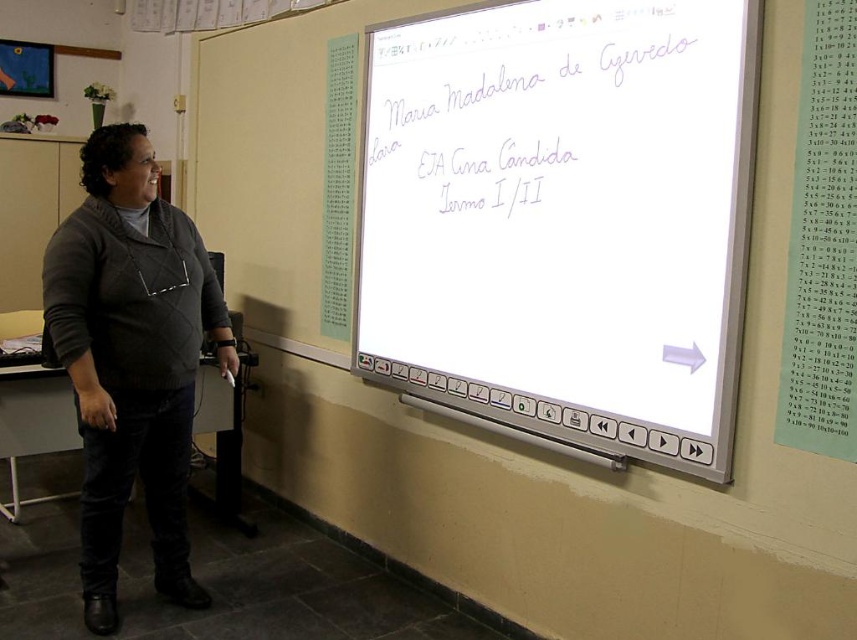
Question: Which point is farther to the camera?

Choices:
 (A) (97, 604)
 (B) (372, 269)

Answer: (B)

Question: Is white glossy screen at upper center smaller than dark gray sweater at left?

Choices:
 (A) no
 (B) yes

Answer: (A)

Question: Which point is closer to the camera taking this photo?

Choices:
 (A) click(608, 387)
 (B) click(64, 301)

Answer: (A)

Question: Is white glossy screen at upper center below dark gray sweater at left?

Choices:
 (A) no
 (B) yes

Answer: (A)

Question: Does white glossy screen at upper center appear on the left side of dark gray sweater at left?

Choices:
 (A) no
 (B) yes

Answer: (A)